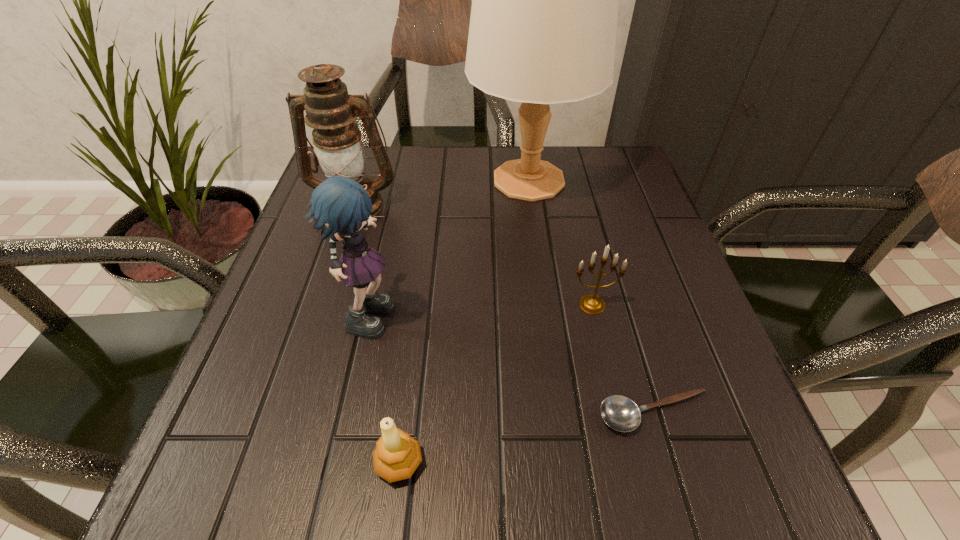
The height and width of the screenshot is (540, 960). I want to click on free space between the tallest object and the lantern, so click(x=442, y=192).

Identify the location of free area in between the lantern and the tallest object. (442, 192).

This screenshot has height=540, width=960. Identify the location of vacant area that lies between the farther candle_holder and the ladle. (623, 359).

Where is `vacant space in between the left candle_holder and the right candle_holder`? vacant space in between the left candle_holder and the right candle_holder is located at coordinates (495, 383).

Identify the location of vacant area that lies between the rag doll and the second shortest object. (386, 386).

In order to click on blank region between the tallest object and the rag doll in this screenshot , I will do `click(450, 245)`.

This screenshot has height=540, width=960. Find the location of `free space between the taller candle_holder and the shortest object`. free space between the taller candle_holder and the shortest object is located at coordinates (623, 359).

This screenshot has width=960, height=540. I want to click on object that stands as the second closest to the ladle, so click(x=397, y=455).

Select which object is the fourth closest to the table lamp. Please provide its 2D coordinates. Your answer should be formatted as a tuple, i.e. [(x, y)], where the tuple contains the x and y coordinates of a point satisfying the conditions above.

[(620, 413)]

I want to click on vacant region that satisfies the following two spatial constraints: 1. on the front side of the left candle_holder; 2. on the left side of the lantern, so click(x=270, y=463).